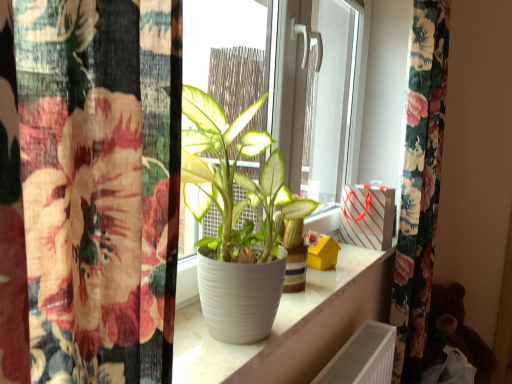
Question: From the image's perspective, is white striped paper bag at upper right located beneath white matte pot at center?

Choices:
 (A) yes
 (B) no

Answer: (A)

Question: Is white striped paper bag at upper right directly adjacent to white matte pot at center?

Choices:
 (A) yes
 (B) no

Answer: (B)

Question: Can you confirm if white striped paper bag at upper right is wider than white matte pot at center?

Choices:
 (A) yes
 (B) no

Answer: (B)

Question: From a real-world perspective, is white striped paper bag at upper right on white matte pot at center?

Choices:
 (A) yes
 (B) no

Answer: (B)

Question: Is white striped paper bag at upper right positioned in front of white matte pot at center?

Choices:
 (A) no
 (B) yes

Answer: (A)

Question: Looking at their shapes, would you say brown plush bear at lower right is wider or thinner than white glossy pot at center?

Choices:
 (A) thin
 (B) wide

Answer: (B)

Question: In terms of height, does brown plush bear at lower right look taller or shorter compared to white glossy pot at center?

Choices:
 (A) short
 (B) tall

Answer: (B)

Question: In terms of size, does brown plush bear at lower right appear bigger or smaller than white glossy pot at center?

Choices:
 (A) big
 (B) small

Answer: (A)

Question: Based on their positions, is brown plush bear at lower right located to the left or right of white glossy pot at center?

Choices:
 (A) right
 (B) left

Answer: (A)

Question: Looking at their shapes, would you say white striped paper bag at upper right is wider or thinner than white matte pot at center?

Choices:
 (A) thin
 (B) wide

Answer: (A)

Question: Does point (375, 188) appear closer or farther from the camera than point (187, 97)?

Choices:
 (A) closer
 (B) farther

Answer: (B)

Question: From the image's perspective, is white striped paper bag at upper right positioned above or below white matte pot at center?

Choices:
 (A) below
 (B) above

Answer: (A)

Question: Is white striped paper bag at upper right to the left or to the right of white matte pot at center in the image?

Choices:
 (A) left
 (B) right

Answer: (B)

Question: Considering the positions of point (205, 306) and point (357, 208), is point (205, 306) closer or farther from the camera than point (357, 208)?

Choices:
 (A) farther
 (B) closer

Answer: (B)

Question: Visually, is white matte pot at center positioned to the left or to the right of white striped paper bag at upper right?

Choices:
 (A) right
 (B) left

Answer: (B)